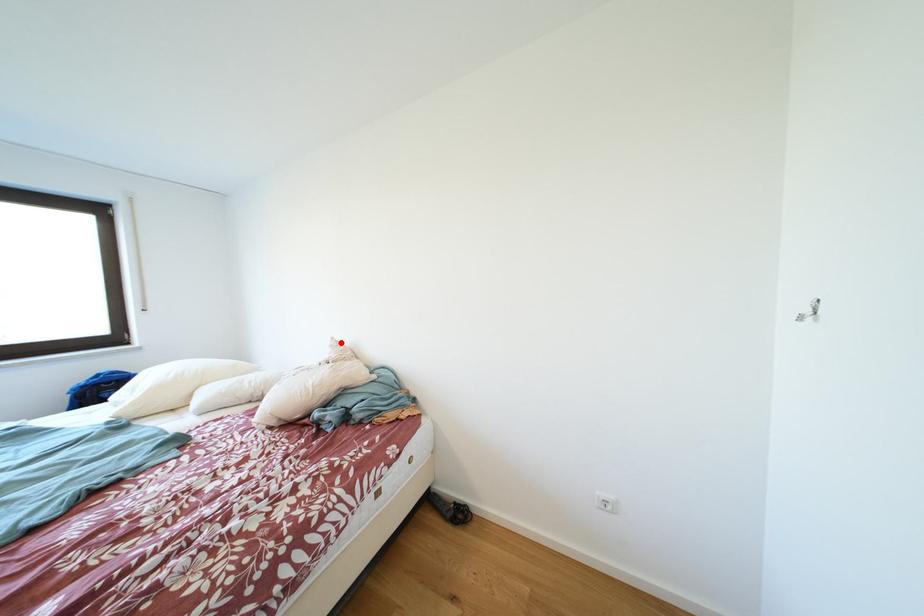
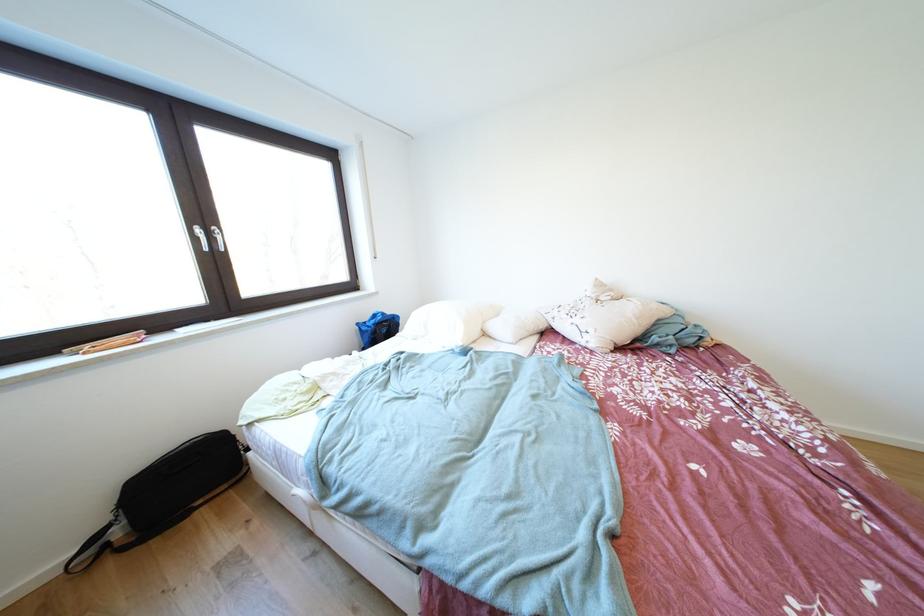
The point at the highlighted location is marked in the first image. Where is the corresponding point in the second image?

(604, 284)